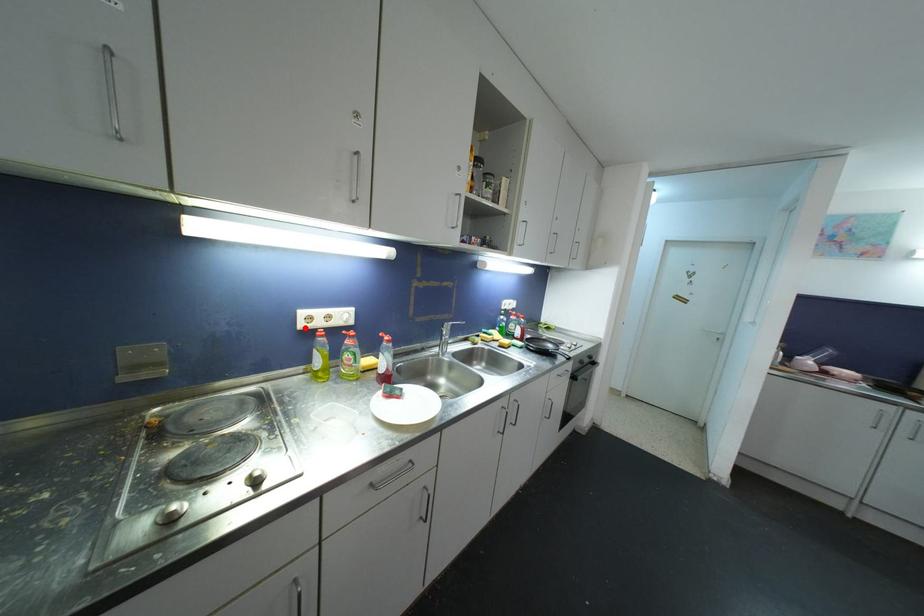
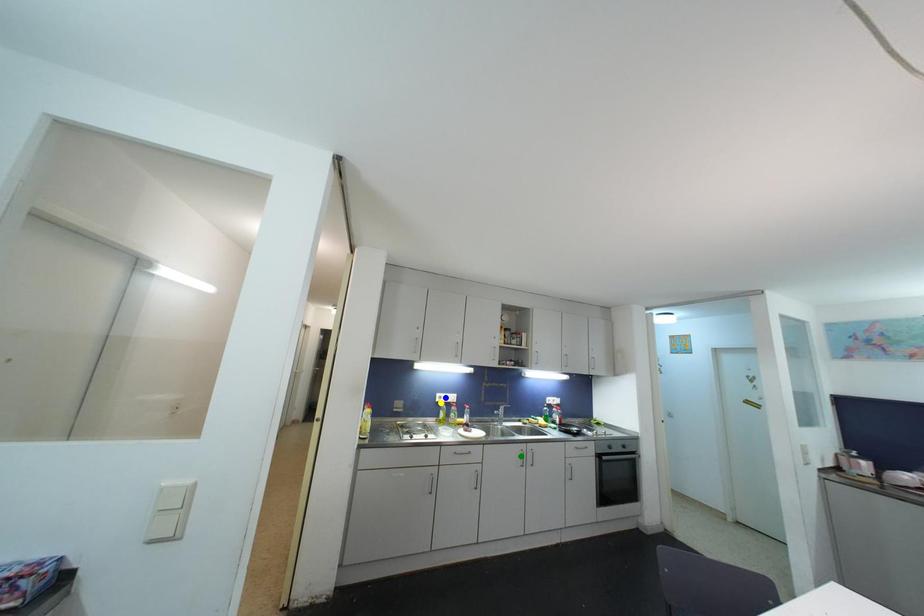
Question: I am providing you with two images of the same scene from different viewpoints. A red point is marked on the first image. You are given multiple points on the second image. Which mark in image 2 goes with the point in image 1?

Choices:
 (A) green point
 (B) blue point
 (C) yellow point

Answer: (C)